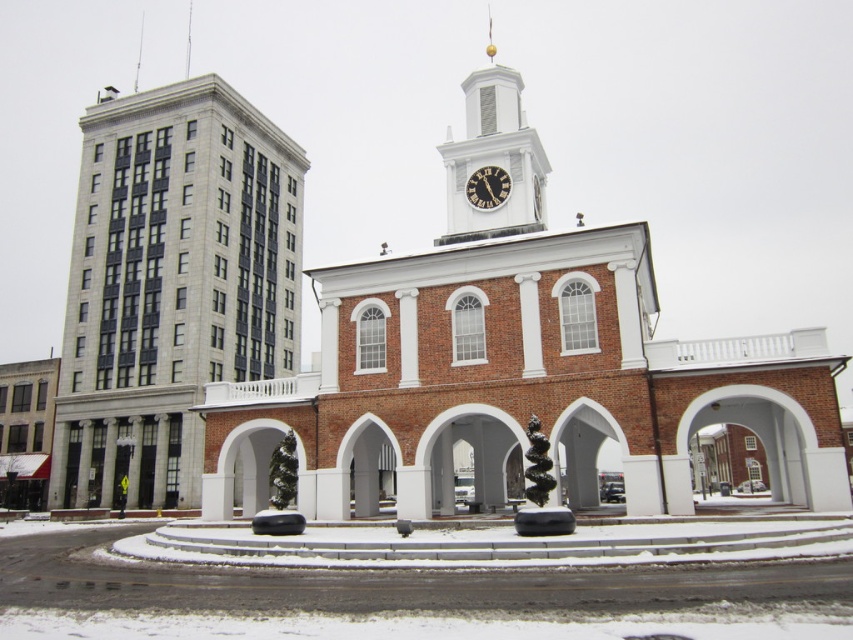
Who is lower down, brick building at center or black glossy clock at center?

Positioned lower is black glossy clock at center.

Which of these two, brick building at center or black glossy clock at center, stands shorter?

black glossy clock at center is shorter.

Image resolution: width=853 pixels, height=640 pixels. What do you see at coordinates (514, 362) in the screenshot?
I see `brick building at center` at bounding box center [514, 362].

In order to click on brick building at center in this screenshot , I will do `click(514, 362)`.

Which is below, gray stone building at left or black glossy clock at center?

gray stone building at left is below.

Is point (196, 362) positioned before point (477, 205)?

No, it is behind (477, 205).

Locate an element on the screen. This screenshot has width=853, height=640. gray stone building at left is located at coordinates (171, 284).

Find the location of a particular element. Image resolution: width=853 pixels, height=640 pixels. gray stone building at left is located at coordinates (171, 284).

Is brick building at center to the right of white painted wood clock tower at upper center from the viewer's perspective?

Indeed, brick building at center is positioned on the right side of white painted wood clock tower at upper center.

Which is in front, point (346, 488) or point (529, 179)?

Positioned in front is point (346, 488).

I want to click on brick building at center, so click(514, 362).

Where is `brick building at center`? The image size is (853, 640). brick building at center is located at coordinates coord(514,362).